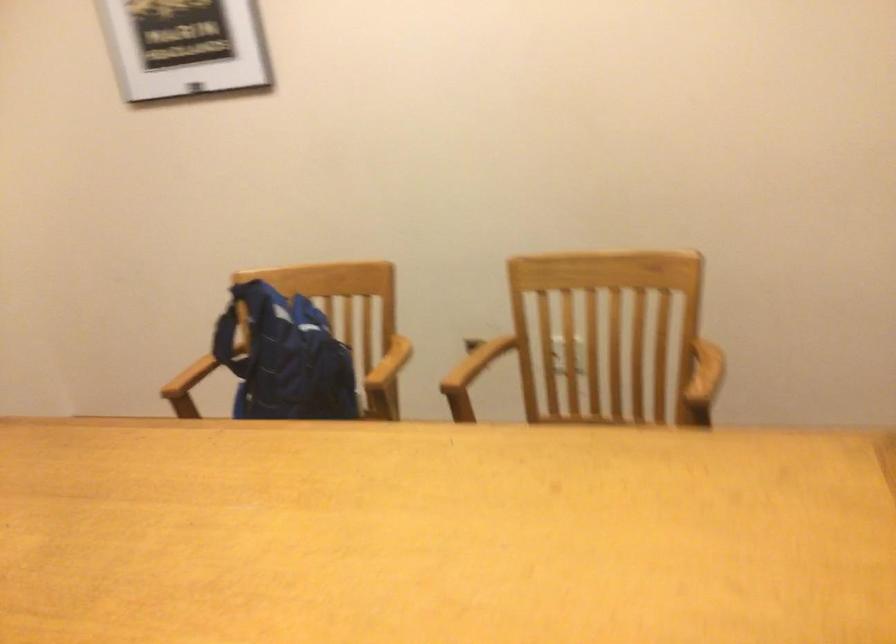
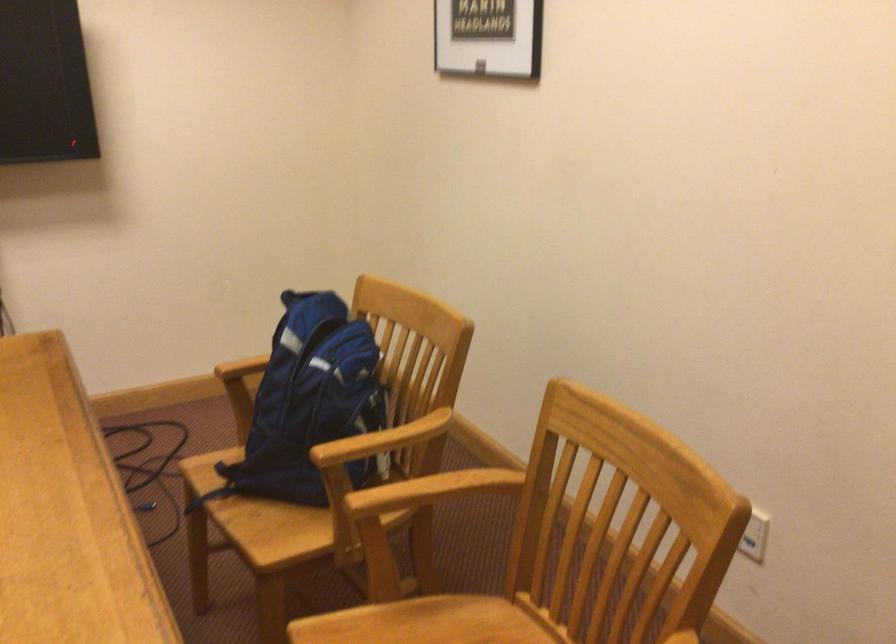
The point at (x=308, y=361) is marked in the first image. Where is the corresponding point in the second image?

(309, 404)